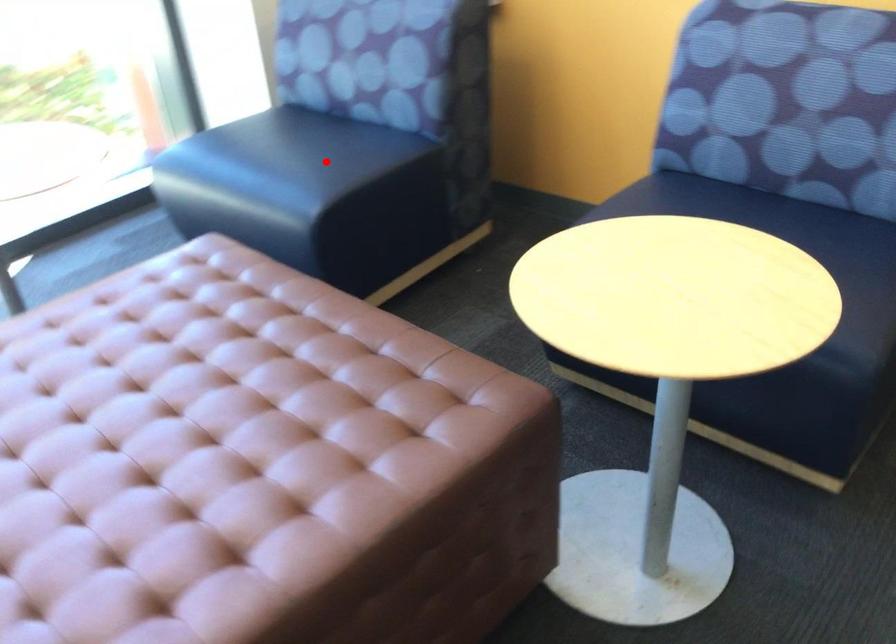
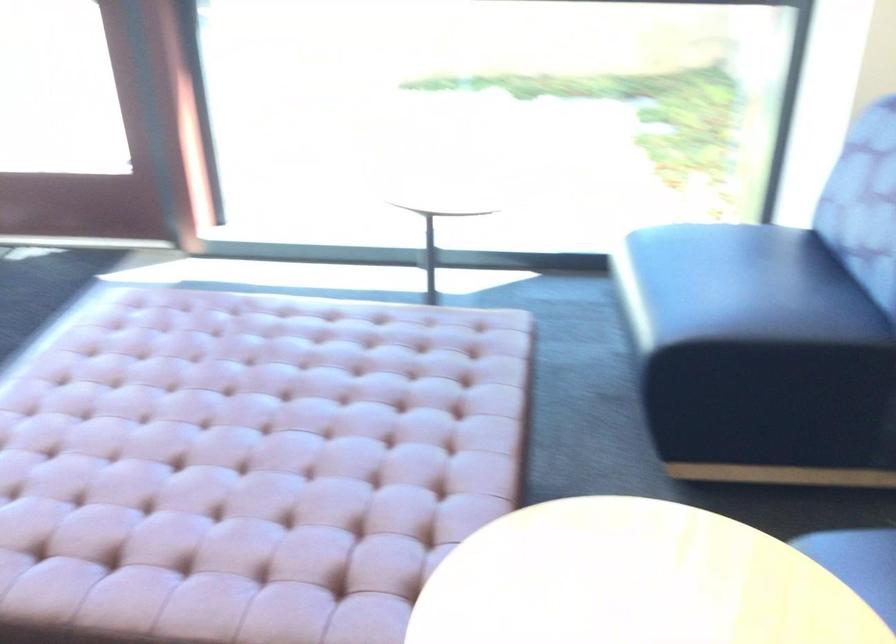
In the second image, find the point that corresponds to the highlighted location in the first image.

(724, 301)